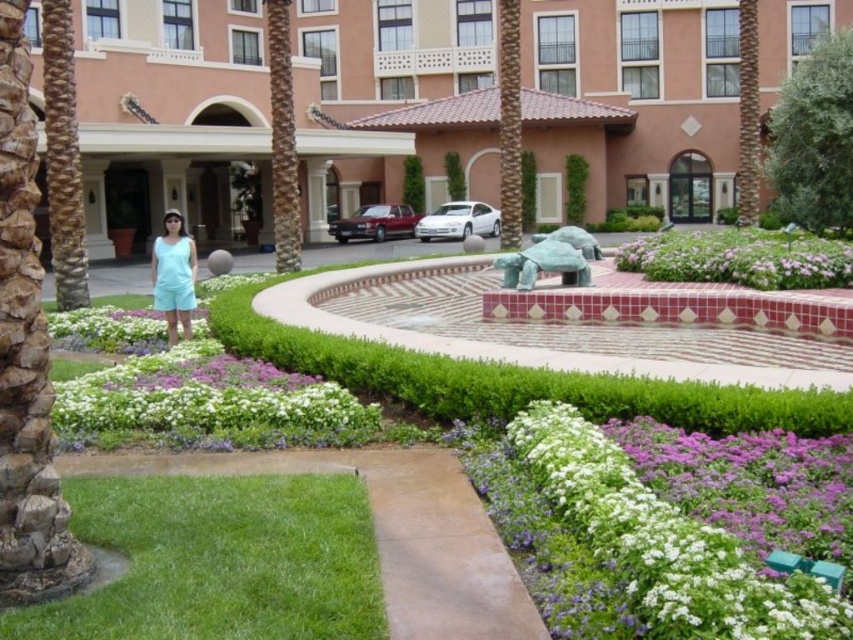
Question: Which of the following is the closest to the observer?

Choices:
 (A) green grass at lower left
 (B) purple matte flowers at center
 (C) light blue fabric shorts at center

Answer: (A)

Question: Can you confirm if light blue fabric shorts at center is thinner than light blue fabric dress at center?

Choices:
 (A) yes
 (B) no

Answer: (B)

Question: Considering the relative positions of green textured palm tree at center and green patina turtle at center in the image provided, where is green textured palm tree at center located with respect to green patina turtle at center?

Choices:
 (A) right
 (B) left

Answer: (B)

Question: Which object appears farthest from the camera in this image?

Choices:
 (A) green grass at lower left
 (B) light blue fabric dress at center
 (C) brown textured palm tree at left

Answer: (C)

Question: Can you confirm if green grass at lower left is bigger than brown textured palm tree at left?

Choices:
 (A) no
 (B) yes

Answer: (B)

Question: Which of the following is the closest to the observer?

Choices:
 (A) (819, 250)
 (B) (450, 616)

Answer: (B)